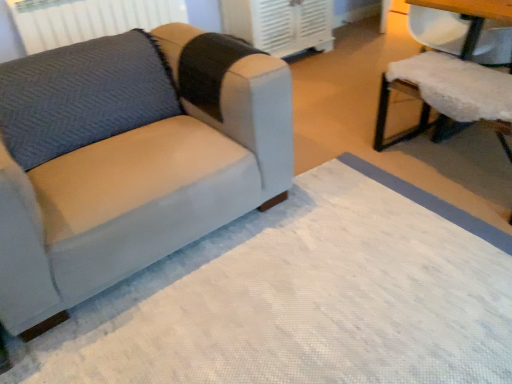
Find the location of a particular element. The height and width of the screenshot is (384, 512). white textured mat at lower left is located at coordinates (303, 298).

In order to face gray fabric radiator at upper left, should I rotate leftwards or rightwards?

To face it directly, rotate left by 19.211 degrees.

This screenshot has height=384, width=512. Describe the element at coordinates (130, 158) in the screenshot. I see `suede-like gray couch at left` at that location.

You are a GUI agent. You are given a task and a screenshot of the screen. Output one action in this format:
    pyautogui.click(x=<x>, y=<y>)
    Task: Click on the white textured mat at lower left
    The height and width of the screenshot is (384, 512).
    Given the screenshot: What is the action you would take?
    pyautogui.click(x=303, y=298)

From the image's perspective, is gray fabric radiator at upper left beneath white plastic air conditioner at upper center?

Yes, from the image's perspective, gray fabric radiator at upper left is beneath white plastic air conditioner at upper center.

Is gray fabric radiator at upper left not near white plastic air conditioner at upper center?

No, gray fabric radiator at upper left is not far from white plastic air conditioner at upper center.

Considering the sizes of objects gray fabric radiator at upper left and white plastic air conditioner at upper center in the image provided, who is taller, gray fabric radiator at upper left or white plastic air conditioner at upper center?

white plastic air conditioner at upper center is taller.

From a real-world perspective, is gray fabric radiator at upper left located beneath white plastic air conditioner at upper center?

No, from a real-world perspective, gray fabric radiator at upper left is not beneath white plastic air conditioner at upper center.

From the picture: Is white textured mat at lower left completely or partially outside of white fluffy cushion at right?

white textured mat at lower left lies outside white fluffy cushion at right's area.

Does point (191, 377) appear closer or farther from the camera than point (444, 6)?

Point (191, 377) is closer to the camera than point (444, 6).

Where is `chair on the right of white textured mat at lower left`? chair on the right of white textured mat at lower left is located at coordinates (471, 15).

From the picture: From the image's perspective, between suede-like gray couch at left and gray fabric radiator at upper left, who is located below?

suede-like gray couch at left, from the image's perspective.

Measure the distance from suede-like gray couch at left to gray fabric radiator at upper left.

suede-like gray couch at left and gray fabric radiator at upper left are 1.38 meters apart from each other.

From a real-world perspective, is suede-like gray couch at left physically above gray fabric radiator at upper left?

No.

Is suede-like gray couch at left wider than gray fabric radiator at upper left?

Yes, suede-like gray couch at left is wider than gray fabric radiator at upper left.

From the image's perspective, is gray fabric radiator at upper left on suede-like gray couch at left?

Yes, from the image's perspective, gray fabric radiator at upper left is above suede-like gray couch at left.

At what (x,y) coordinates should I click in order to perform the action: click on radiator behind the suede-like gray couch at left. Please return your answer as a coordinate pair (x, y). The height and width of the screenshot is (384, 512). Looking at the image, I should click on (88, 19).

Visually, is gray fabric radiator at upper left positioned to the left or to the right of suede-like gray couch at left?

Clearly, gray fabric radiator at upper left is on the left of suede-like gray couch at left in the image.

Considering the relative sizes of gray fabric radiator at upper left and suede-like gray couch at left in the image provided, is gray fabric radiator at upper left bigger than suede-like gray couch at left?

Actually, gray fabric radiator at upper left might be smaller than suede-like gray couch at left.

In the scene shown: Is gray fabric radiator at upper left oriented towards white fluffy cushion at right?

Yes, gray fabric radiator at upper left faces towards white fluffy cushion at right.

Considering the relative sizes of gray fabric radiator at upper left and white fluffy cushion at right in the image provided, is gray fabric radiator at upper left bigger than white fluffy cushion at right?

Actually, gray fabric radiator at upper left might be smaller than white fluffy cushion at right.

Does gray fabric radiator at upper left appear on the right side of white fluffy cushion at right?

Incorrect, gray fabric radiator at upper left is not on the right side of white fluffy cushion at right.

Consider the image. Between white plastic air conditioner at upper center and white textured mat at lower left, which one has smaller width?

With smaller width is white plastic air conditioner at upper center.

From the image's perspective, does white plastic air conditioner at upper center appear lower than white textured mat at lower left?

No, from the image's perspective, white plastic air conditioner at upper center is not beneath white textured mat at lower left.

At what (x,y) coordinates should I click in order to perform the action: click on air conditioning above the white textured mat at lower left (from a real-world perspective). Please return your answer as a coordinate pair (x, y). Looking at the image, I should click on (280, 24).

Looking at this image, from a real-world perspective, is white plastic air conditioner at upper center beneath white textured mat at lower left?

No, from a real-world perspective, white plastic air conditioner at upper center is not under white textured mat at lower left.

Which is more to the right, white fluffy cushion at right or suede-like gray couch at left?

white fluffy cushion at right is more to the right.

Is white fluffy cushion at right far from suede-like gray couch at left?

Yes.

Is the position of white fluffy cushion at right less distant than that of suede-like gray couch at left?

No, it is not.

Considering the points (400, 83) and (2, 66), which point is behind, point (400, 83) or point (2, 66)?

The point (400, 83) is behind.

You are a GUI agent. You are given a task and a screenshot of the screen. Output one action in this format:
    pyautogui.click(x=<x>, y=<y>)
    Task: Click on the radiator located above the white plastic air conditioner at upper center (from a real-world perspective)
    This screenshot has width=512, height=384.
    Given the screenshot: What is the action you would take?
    pyautogui.click(x=88, y=19)

In the image, there is a white fluffy cushion at right. Identify the location of mat below it (from a real-world perspective). (303, 298).

Considering their positions, is white plastic air conditioner at upper center positioned closer to suede-like gray couch at left than gray fabric radiator at upper left?

gray fabric radiator at upper left.

Based on their spatial positions, is suede-like gray couch at left or white plastic air conditioner at upper center closer to gray fabric radiator at upper left?

white plastic air conditioner at upper center lies closer to gray fabric radiator at upper left than the other object.

Which object lies further to the anchor point gray fabric radiator at upper left, white plastic air conditioner at upper center or suede-like gray couch at left?

Among the two, suede-like gray couch at left is located further to gray fabric radiator at upper left.

Looking at the image, which one is located further to gray fabric radiator at upper left, white fluffy cushion at right or suede-like gray couch at left?

white fluffy cushion at right lies further to gray fabric radiator at upper left than the other object.

Estimate the real-world distances between objects in this image. Which object is closer to white textured mat at lower left, gray fabric radiator at upper left or suede-like gray couch at left?

suede-like gray couch at left lies closer to white textured mat at lower left than the other object.

From the image, which object appears to be nearer to white plastic air conditioner at upper center, gray fabric radiator at upper left or white fluffy cushion at right?

The object closer to white plastic air conditioner at upper center is gray fabric radiator at upper left.

When comparing their distances from white fluffy cushion at right, does suede-like gray couch at left or white plastic air conditioner at upper center seem closer?

Based on the image, white plastic air conditioner at upper center appears to be nearer to white fluffy cushion at right.

Looking at the image, which one is located closer to suede-like gray couch at left, gray fabric radiator at upper left or white textured mat at lower left?

white textured mat at lower left.

The image size is (512, 384). What are the coordinates of `studio couch between gray fabric radiator at upper left and white textured mat at lower left from left to right` in the screenshot? It's located at (130, 158).

I want to click on mat situated between gray fabric radiator at upper left and white fluffy cushion at right from left to right, so click(303, 298).

You are a GUI agent. You are given a task and a screenshot of the screen. Output one action in this format:
    pyautogui.click(x=<x>, y=<y>)
    Task: Click on the studio couch between gray fabric radiator at upper left and white fluffy cushion at right from left to right
    Image resolution: width=512 pixels, height=384 pixels.
    Given the screenshot: What is the action you would take?
    pyautogui.click(x=130, y=158)

Locate an element on the screen. The width and height of the screenshot is (512, 384). mat between suede-like gray couch at left and white fluffy cushion at right is located at coordinates (303, 298).